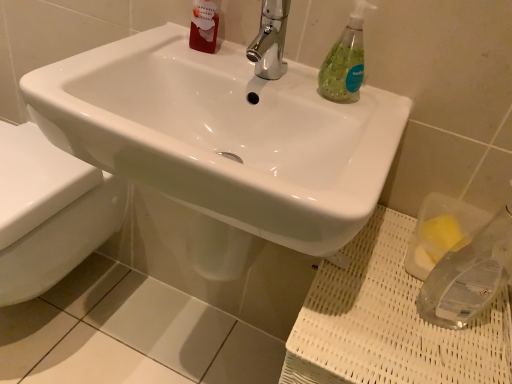
Locate an element on the screen. free space in front of translucent red liquid at upper left is located at coordinates (175, 60).